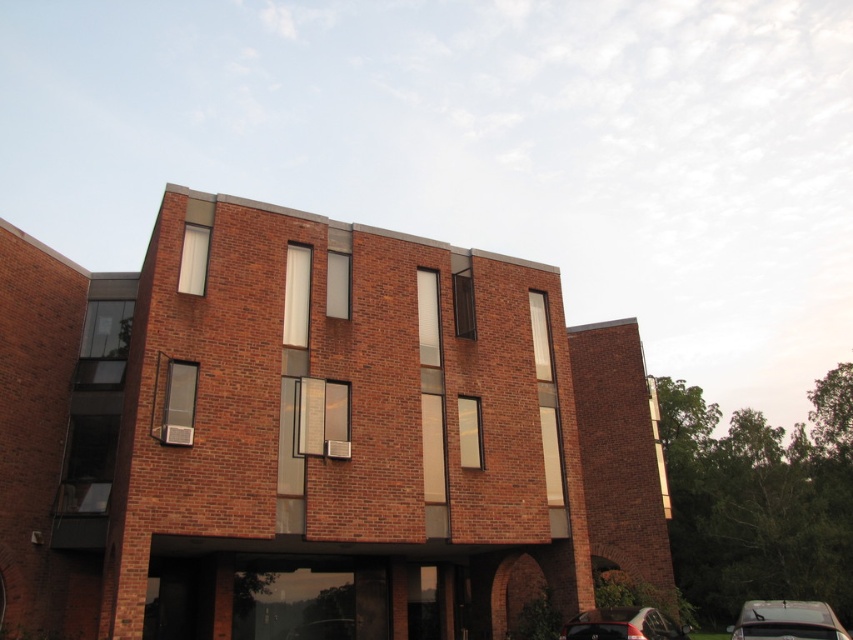
You are standing at the entrance of the building and want to reach the point marked at coordinates point (x=807, y=632). Given that the distance between you and this point is 9.21 meters, can you estimate how many steps it would take if each step is approximately 0.75 meters long?

The distance between you and the point (x=807, y=632) is 9.21 meters. Dividing this by the step length of 0.75 meters gives approximately 12.28 steps. Therefore, it would take around 12 steps to reach the point.

You are a delivery person approaching the entrance of the building. You see two cars parked at the lower right corner of the image. Which car is closer to the entrance area? The metallic silver car at lower right or the shiny black car at lower right?

The metallic silver car at lower right is closer to the entrance area because it is located below the shiny black car at lower right, indicating it is parked lower down near the entrance.

In the scene shown: You are driving a car and want to park in the parking lot near the multi story brick building. You see two cars already parked at the lower right corner. Which car is closer to the entrance of the building? The metallic silver car at lower right or the shiny black car at lower right?

The shiny black car at lower right is closer to the entrance of the building because the metallic silver car at lower right is to the right of it, meaning the shiny black car is positioned more towards the entrance side.